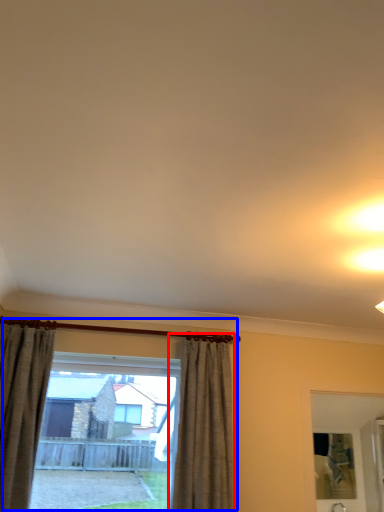
Question: Which object is further to the camera taking this photo, curtain (highlighted by a red box) or window (highlighted by a blue box)?

Choices:
 (A) curtain
 (B) window

Answer: (B)